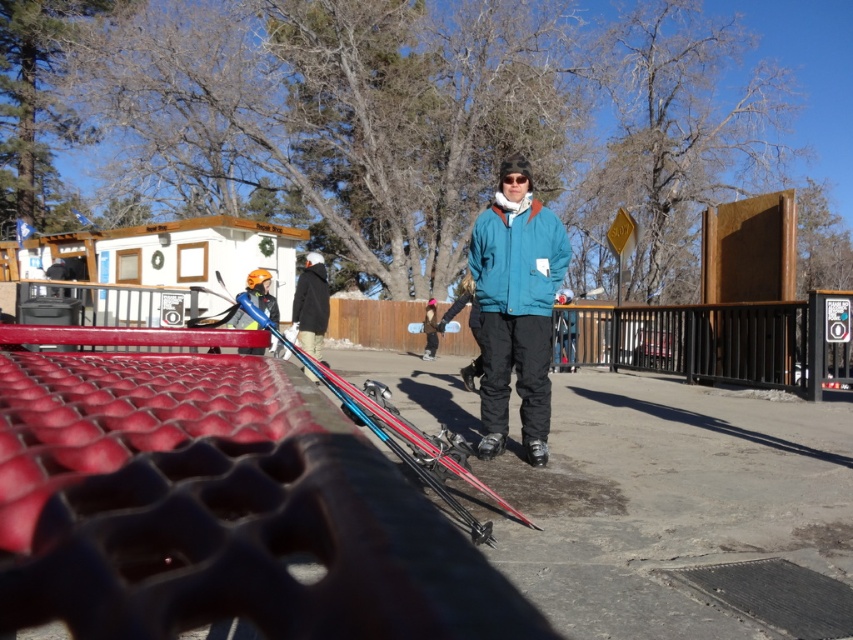
Question: Which point appears closest to the camera in this image?

Choices:
 (A) (564, 260)
 (B) (548, 419)
 (C) (473, 474)
 (D) (277, 310)

Answer: (C)

Question: Does teal fabric jacket at center appear over matte yellow helmet at left?

Choices:
 (A) no
 (B) yes

Answer: (A)

Question: Which object appears farthest from the camera in this image?

Choices:
 (A) black matte jacket at center
 (B) teal fleece jacket at center
 (C) dark blue jacket at center

Answer: (C)

Question: Is teal fabric jacket at center smaller than shiny blue ski at center?

Choices:
 (A) yes
 (B) no

Answer: (B)

Question: Which object is positioned closest to the dark blue jacket at center?

Choices:
 (A) black matte jacket at center
 (B) shiny blue ski at center
 (C) teal fabric jacket at center

Answer: (A)

Question: Does teal fabric jacket at center lie in front of dark blue jacket at center?

Choices:
 (A) no
 (B) yes

Answer: (B)